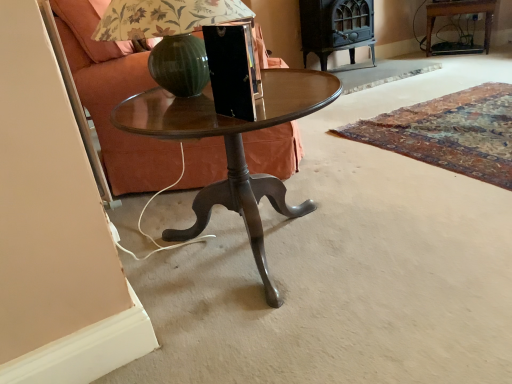
Find the location of a particular element. Image resolution: width=512 pixels, height=384 pixels. matte brown fabric armchair at left is located at coordinates (114, 98).

Where is `wooden side table at upper right`? wooden side table at upper right is located at coordinates (460, 13).

Locate an element on the screen. This screenshot has height=384, width=512. metallic green glass at center is located at coordinates (170, 36).

Locate an element on the screen. matte brown fabric armchair at left is located at coordinates (114, 98).

Which point is more forward, [146,10] or [144,111]?

The point [146,10] is more forward.

How different are the orientations of metallic green glass at center and wooden glossy table at center in degrees?

There is a 0.000445-degree angle between the facing directions of metallic green glass at center and wooden glossy table at center.

Visually, is metallic green glass at center positioned to the left or to the right of wooden glossy table at center?

In the image, metallic green glass at center appears on the left side of wooden glossy table at center.

Find the location of `coffee table that appears below the metallic green glass at center (from a real-world perspective)`. coffee table that appears below the metallic green glass at center (from a real-world perspective) is located at coordinates (233, 147).

Does matte brown fabric armchair at left lie behind wooden glossy table at center?

Yes.

Considering the sizes of objects matte brown fabric armchair at left and wooden glossy table at center in the image provided, who is shorter, matte brown fabric armchair at left or wooden glossy table at center?

Standing shorter between the two is wooden glossy table at center.

Which is further, (294,151) or (164,235)?

The point (294,151) is farther.

From the image's perspective, which is above, matte brown fabric armchair at left or wooden glossy table at center?

matte brown fabric armchair at left, from the image's perspective.

Which point is more forward, (253,245) or (250,155)?

The point (253,245) is in front.

From a real-world perspective, between wooden glossy table at center and matte brown fabric armchair at left, who is vertically lower?

wooden glossy table at center is physically lower.

Does wooden glossy table at center appear on the left side of matte brown fabric armchair at left?

Incorrect, wooden glossy table at center is not on the left side of matte brown fabric armchair at left.

Could you tell me if wooden glossy table at center is facing matte brown fabric armchair at left?

No, wooden glossy table at center is not aimed at matte brown fabric armchair at left.

Looking at this image, from the image's perspective, is matte brown fabric armchair at left above metallic green glass at center?

Yes, from the image's perspective, matte brown fabric armchair at left is above metallic green glass at center.

Is matte brown fabric armchair at left wider or thinner than metallic green glass at center?

Clearly, matte brown fabric armchair at left has more width compared to metallic green glass at center.

The image size is (512, 384). I want to click on armchair that appears above the metallic green glass at center (from the image's perspective), so click(x=114, y=98).

Is matte brown fabric armchair at left facing towards metallic green glass at center?

No, matte brown fabric armchair at left is not oriented towards metallic green glass at center.

Would you say wooden glossy table at center is a long distance from metallic green glass at center?

Actually, wooden glossy table at center and metallic green glass at center are a little close together.

Is wooden glossy table at center not inside metallic green glass at center?

Yes, wooden glossy table at center is located beyond the bounds of metallic green glass at center.

Considering the relative positions of wooden glossy table at center and metallic green glass at center in the image provided, is wooden glossy table at center to the left of metallic green glass at center from the viewer's perspective?

No.

Considering the sizes of objects wooden glossy table at center and metallic green glass at center in the image provided, who is smaller, wooden glossy table at center or metallic green glass at center?

metallic green glass at center.

Considering the sizes of objects wooden side table at upper right and metallic green glass at center in the image provided, who is shorter, wooden side table at upper right or metallic green glass at center?

metallic green glass at center is shorter.

Is wooden side table at upper right not near metallic green glass at center?

Yes, wooden side table at upper right and metallic green glass at center are quite far apart.

From a real-world perspective, which is physically above, wooden side table at upper right or metallic green glass at center?

From a 3D spatial view, metallic green glass at center is above.

From the image's perspective, which is above, metallic green glass at center or matte brown fabric armchair at left?

matte brown fabric armchair at left, from the image's perspective.

Are metallic green glass at center and matte brown fabric armchair at left making contact?

No, metallic green glass at center is not in contact with matte brown fabric armchair at left.

Which object is further away from the camera, metallic green glass at center or matte brown fabric armchair at left?

matte brown fabric armchair at left.

Can you confirm if metallic green glass at center is thinner than matte brown fabric armchair at left?

Yes.

Identify the location of table lamp that appears above the wooden glossy table at center (from a real-world perspective). (170, 36).

Image resolution: width=512 pixels, height=384 pixels. In order to click on armchair above the wooden glossy table at center (from the image's perspective) in this screenshot , I will do `click(114, 98)`.

Estimate the real-world distances between objects in this image. Which object is further from wooden side table at upper right, wooden glossy table at center or matte brown fabric armchair at left?

wooden glossy table at center is positioned further to the anchor wooden side table at upper right.

Considering their positions, is metallic green glass at center positioned closer to wooden glossy table at center than matte brown fabric armchair at left?

Based on the image, metallic green glass at center appears to be nearer to wooden glossy table at center.

From the image, which object appears to be farther from matte brown fabric armchair at left, metallic green glass at center or wooden glossy table at center?

wooden glossy table at center is further to matte brown fabric armchair at left.

Which object lies further to the anchor point wooden side table at upper right, matte brown fabric armchair at left or metallic green glass at center?

metallic green glass at center is further to wooden side table at upper right.

Considering their positions, is wooden side table at upper right positioned further to metallic green glass at center than wooden glossy table at center?

wooden side table at upper right.

Based on their spatial positions, is wooden glossy table at center or metallic green glass at center closer to matte brown fabric armchair at left?

metallic green glass at center is positioned closer to the anchor matte brown fabric armchair at left.

Estimate the real-world distances between objects in this image. Which object is closer to matte brown fabric armchair at left, metallic green glass at center or wooden side table at upper right?

metallic green glass at center is positioned closer to the anchor matte brown fabric armchair at left.

Looking at the image, which one is located closer to matte brown fabric armchair at left, wooden side table at upper right or wooden glossy table at center?

The object closer to matte brown fabric armchair at left is wooden glossy table at center.

The width and height of the screenshot is (512, 384). In order to click on table lamp between wooden glossy table at center and matte brown fabric armchair at left along the z-axis in this screenshot , I will do `click(170, 36)`.

Locate an element on the screen. The image size is (512, 384). armchair positioned between metallic green glass at center and wooden side table at upper right from near to far is located at coordinates (114, 98).

This screenshot has width=512, height=384. Find the location of `table lamp positioned between wooden glossy table at center and wooden side table at upper right from near to far`. table lamp positioned between wooden glossy table at center and wooden side table at upper right from near to far is located at coordinates (170, 36).

This screenshot has height=384, width=512. I want to click on armchair between wooden glossy table at center and wooden side table at upper right along the z-axis, so click(114, 98).